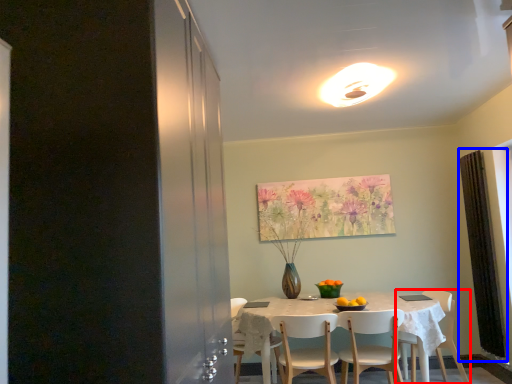
Question: Among these objects, which one is nearest to the camera, chair (highlighted by a red box) or curtain (highlighted by a blue box)?

Choices:
 (A) chair
 (B) curtain

Answer: (A)